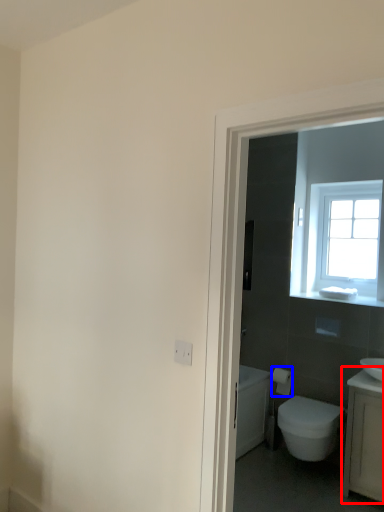
Question: Which object appears closest to the camera in this image, counter top (highlighted by a red box) or toilet paper (highlighted by a blue box)?

Choices:
 (A) counter top
 (B) toilet paper

Answer: (A)